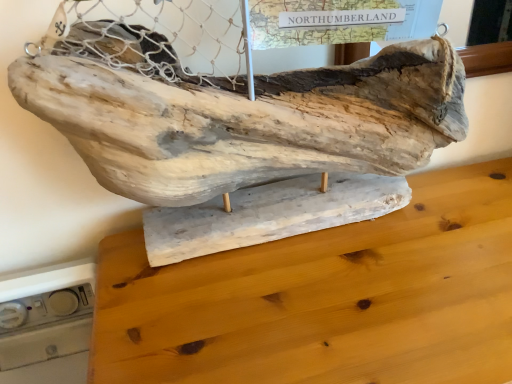
Question: Should I look upward or downward to see natural wood sculpture at center?

Choices:
 (A) down
 (B) up

Answer: (B)

Question: From the image's perspective, is natural wood sculpture at center located beneath natural wood table at center?

Choices:
 (A) no
 (B) yes

Answer: (A)

Question: Considering the relative sizes of natural wood sculpture at center and natural wood table at center in the image provided, is natural wood sculpture at center thinner than natural wood table at center?

Choices:
 (A) yes
 (B) no

Answer: (A)

Question: Can you confirm if natural wood sculpture at center is taller than natural wood table at center?

Choices:
 (A) yes
 (B) no

Answer: (B)

Question: From the image's perspective, is natural wood sculpture at center over natural wood table at center?

Choices:
 (A) no
 (B) yes

Answer: (B)

Question: Considering the relative positions of natural wood sculpture at center and natural wood table at center in the image provided, is natural wood sculpture at center behind natural wood table at center?

Choices:
 (A) yes
 (B) no

Answer: (A)

Question: From a real-world perspective, is natural wood sculpture at center on natural wood table at center?

Choices:
 (A) yes
 (B) no

Answer: (A)

Question: Does natural wood table at center have a greater width compared to natural wood sculpture at center?

Choices:
 (A) yes
 (B) no

Answer: (A)

Question: Could you tell me if natural wood table at center is facing natural wood sculpture at center?

Choices:
 (A) yes
 (B) no

Answer: (B)

Question: Is natural wood table at center further to the viewer compared to natural wood sculpture at center?

Choices:
 (A) no
 (B) yes

Answer: (A)

Question: Is natural wood table at center not inside natural wood sculpture at center?

Choices:
 (A) no
 (B) yes

Answer: (B)

Question: From the image's perspective, is natural wood table at center beneath natural wood sculpture at center?

Choices:
 (A) yes
 (B) no

Answer: (A)

Question: Is natural wood table at center at the left side of natural wood sculpture at center?

Choices:
 (A) no
 (B) yes

Answer: (A)

Question: Based on their positions, is natural wood sculpture at center located to the left or right of natural wood table at center?

Choices:
 (A) right
 (B) left

Answer: (B)